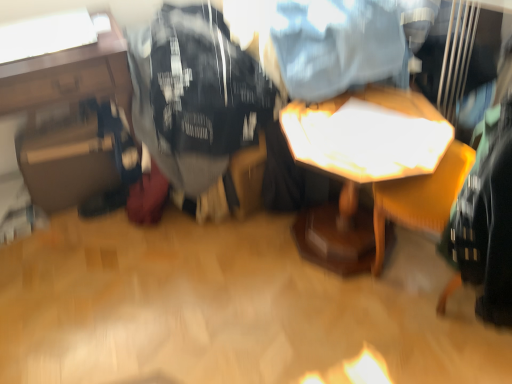
The image size is (512, 384). I want to click on free spot to the left of wooden table at center, the first table when ordered from right to left, so click(x=241, y=274).